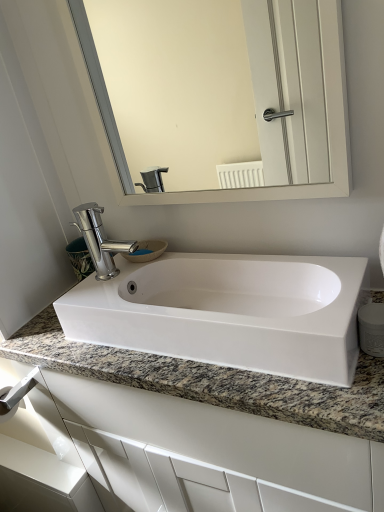
Where is `vacant area that is in front of polished chrome faucet at center`? This screenshot has height=512, width=384. vacant area that is in front of polished chrome faucet at center is located at coordinates point(107,298).